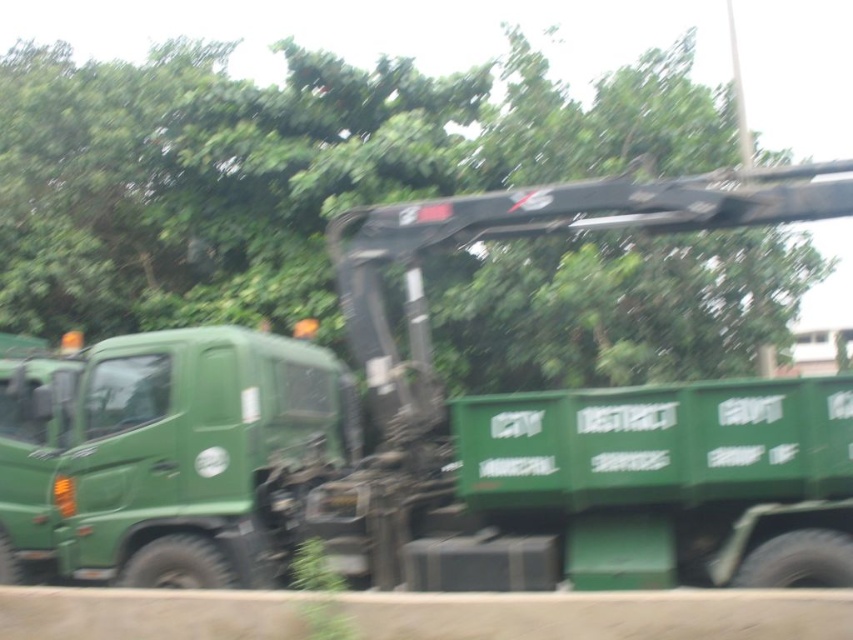
Between green matte tow truck at center and green matte tree at upper center, which one is positioned higher?

Positioned higher is green matte tree at upper center.

Can you confirm if green matte tow truck at center is thinner than green matte tree at upper center?

Indeed, green matte tow truck at center has a lesser width compared to green matte tree at upper center.

Locate an element on the screen. green matte tow truck at center is located at coordinates (430, 436).